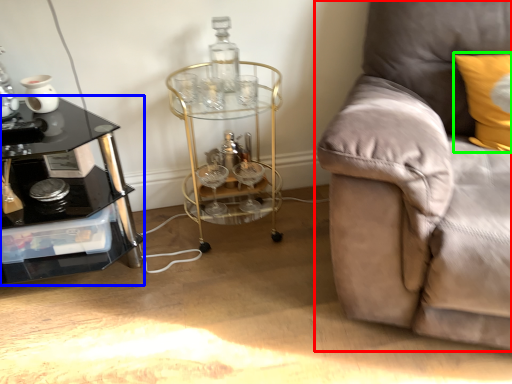
Question: Which object is the closest to the studio couch (highlighted by a red box)? Choose among these: table (highlighted by a blue box) or pillow (highlighted by a green box).

Choices:
 (A) table
 (B) pillow

Answer: (B)